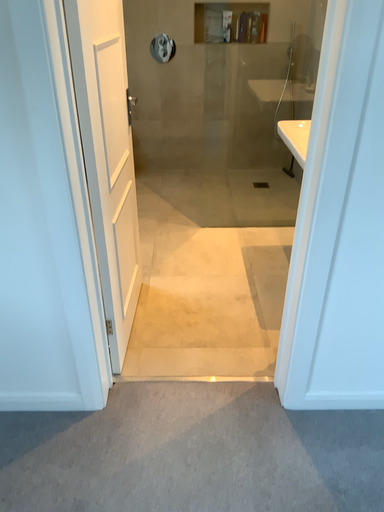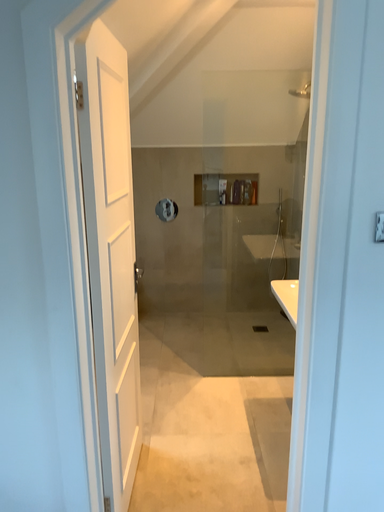
Question: How did the camera likely rotate when shooting the video?

Choices:
 (A) rotated upward
 (B) rotated downward

Answer: (A)